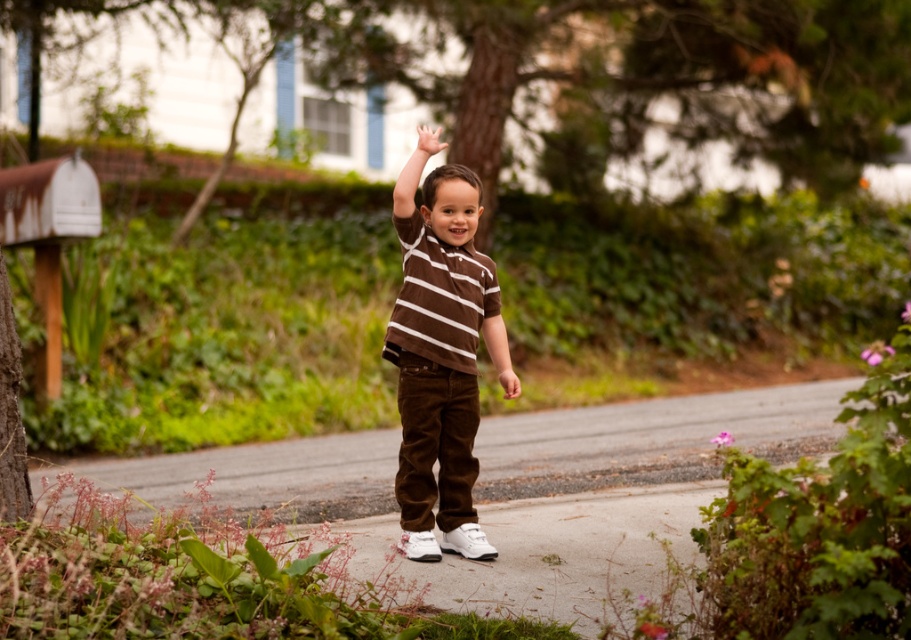
Question: Among these objects, which one is farthest from the camera?

Choices:
 (A) white matte hand at center
 (B) white matte hand at upper center
 (C) brown velvety shirt at center

Answer: (A)

Question: Which point is closer to the camera?

Choices:
 (A) (427, 378)
 (B) (517, 376)

Answer: (A)

Question: Estimate the real-world distances between objects in this image. Which object is closer to the white matte hand at center?

Choices:
 (A) gray asphalt pavement at center
 (B) brown corduroy pants at center
 (C) brown velvety shirt at center
 (D) white matte hand at upper center

Answer: (C)

Question: Observing the image, what is the correct spatial positioning of brown corduroy pants at center in reference to white matte hand at center?

Choices:
 (A) below
 (B) above

Answer: (B)

Question: Does brown velvety shirt at center come in front of white matte hand at center?

Choices:
 (A) no
 (B) yes

Answer: (B)

Question: Can you confirm if gray asphalt pavement at center is wider than white matte hand at upper center?

Choices:
 (A) yes
 (B) no

Answer: (A)